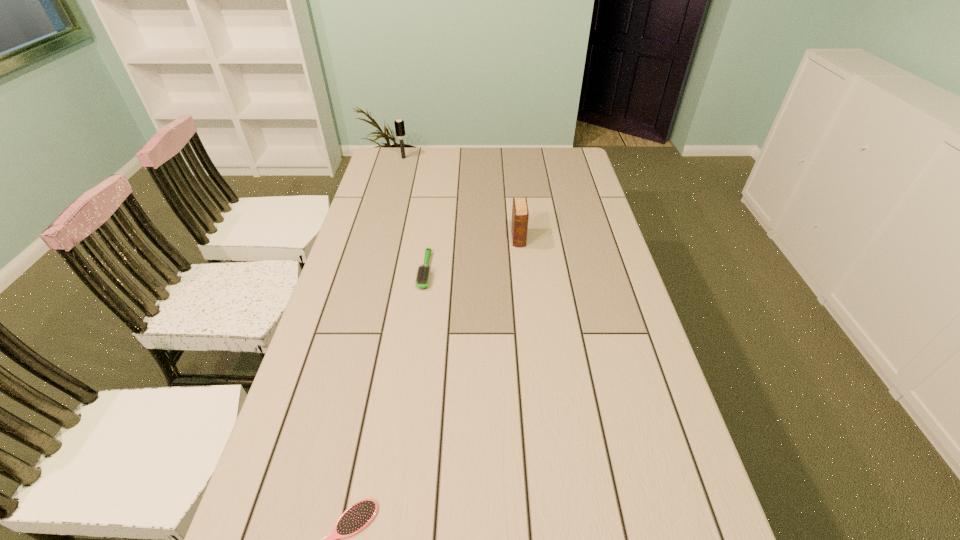
The image size is (960, 540). I want to click on the farthest object, so click(399, 124).

Image resolution: width=960 pixels, height=540 pixels. Find the location of `the tallest object`. the tallest object is located at coordinates click(399, 124).

Where is `the second tallest object`? This screenshot has width=960, height=540. the second tallest object is located at coordinates (520, 214).

The width and height of the screenshot is (960, 540). What are the coordinates of `the second farthest object` in the screenshot? It's located at (520, 214).

Find the location of `the second farthest hairbrush`. the second farthest hairbrush is located at coordinates (422, 277).

You are a GUI agent. You are given a task and a screenshot of the screen. Output one action in this format:
    pyautogui.click(x=<x>, y=<y>)
    Task: Click on the rightmost hairbrush
    This screenshot has width=960, height=540.
    Given the screenshot: What is the action you would take?
    pyautogui.click(x=422, y=277)

Locate an element on the screen. This screenshot has width=960, height=540. vacant region located on the front of the farthest hairbrush is located at coordinates (400, 172).

This screenshot has width=960, height=540. Identify the location of vacant space located on the spine side of the diary. click(522, 275).

Locate an element on the screen. Image resolution: width=960 pixels, height=540 pixels. vacant space situated 0.130m on the right of the second nearest hairbrush is located at coordinates (472, 271).

I want to click on object that is at the far edge, so click(x=399, y=124).